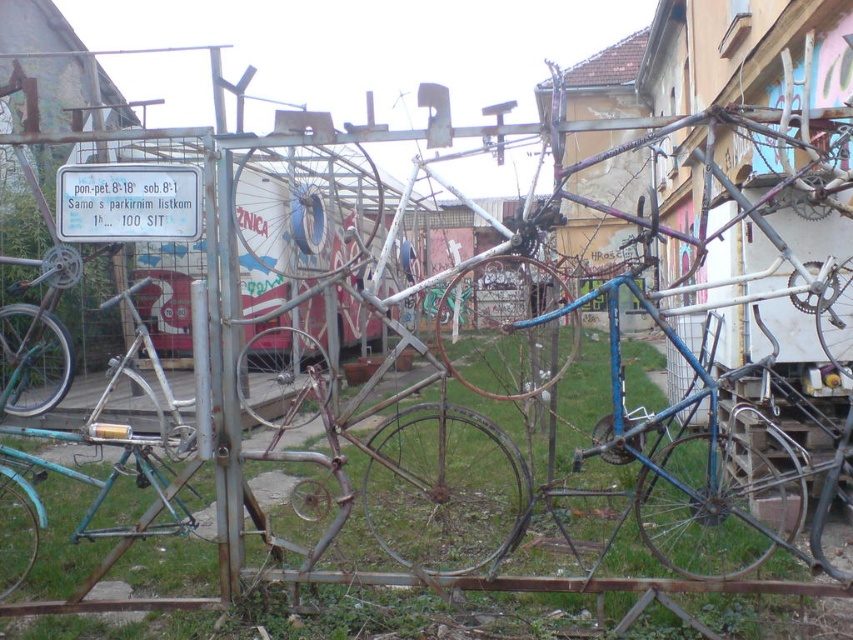
Is point (186, 205) positioned in front of point (53, 371)?

Yes, point (186, 205) is closer to viewer.

Locate an element on the screen. The height and width of the screenshot is (640, 853). white plastic sign at upper left is located at coordinates (128, 202).

Between point (132, 221) and point (12, 349), which one is positioned in front?

Point (132, 221)

Identify the location of white plastic sign at upper left. (128, 202).